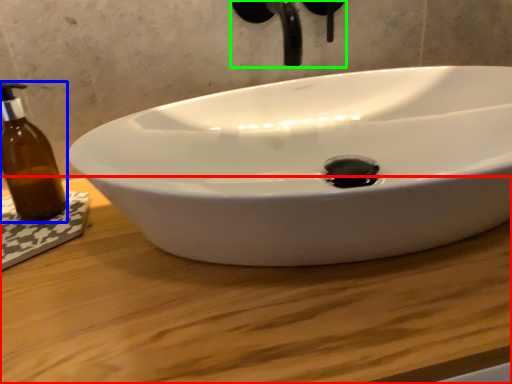
Question: Which is farther away from counter top (highlighted by a red box)? bottle (highlighted by a blue box) or plumbing fixture (highlighted by a green box)?

Choices:
 (A) bottle
 (B) plumbing fixture

Answer: (B)